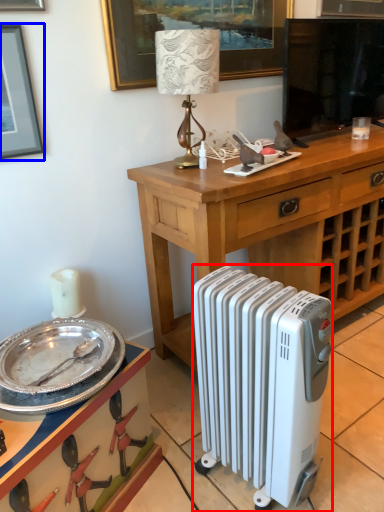
Question: Which of the following is the closest to the observer, radiator (highlighted by a red box) or picture frame (highlighted by a blue box)?

Choices:
 (A) radiator
 (B) picture frame

Answer: (A)